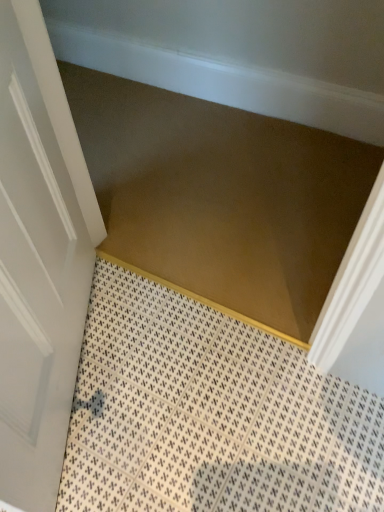
Locate an element on the screen. This screenshot has height=512, width=384. vacant area on top of white textured tile at center (from a real-world perspective) is located at coordinates (187, 410).